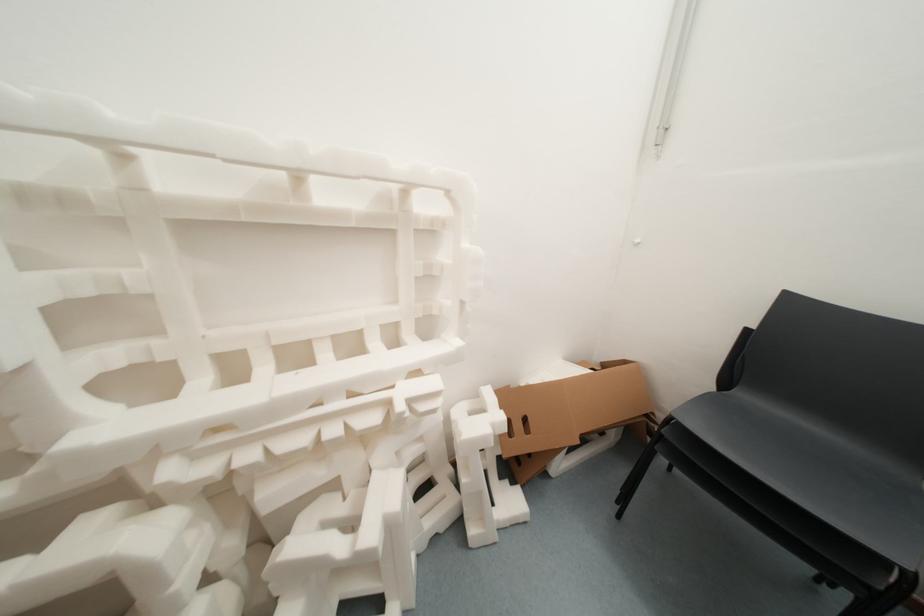
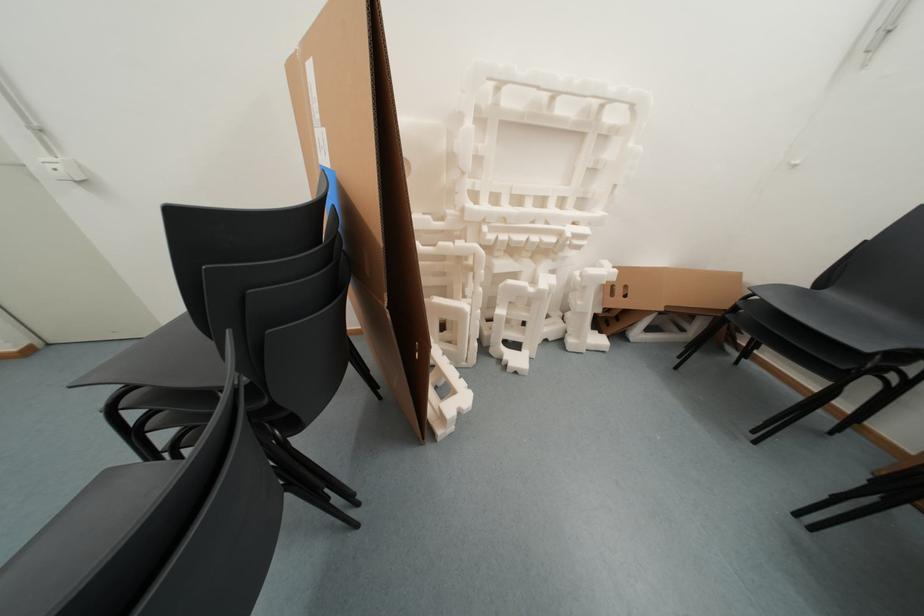
Question: The first image is from the beginning of the video and the second image is from the end. How did the camera likely rotate when shooting the video?

Choices:
 (A) Left
 (B) Right
 (C) Up
 (D) Down

Answer: (A)